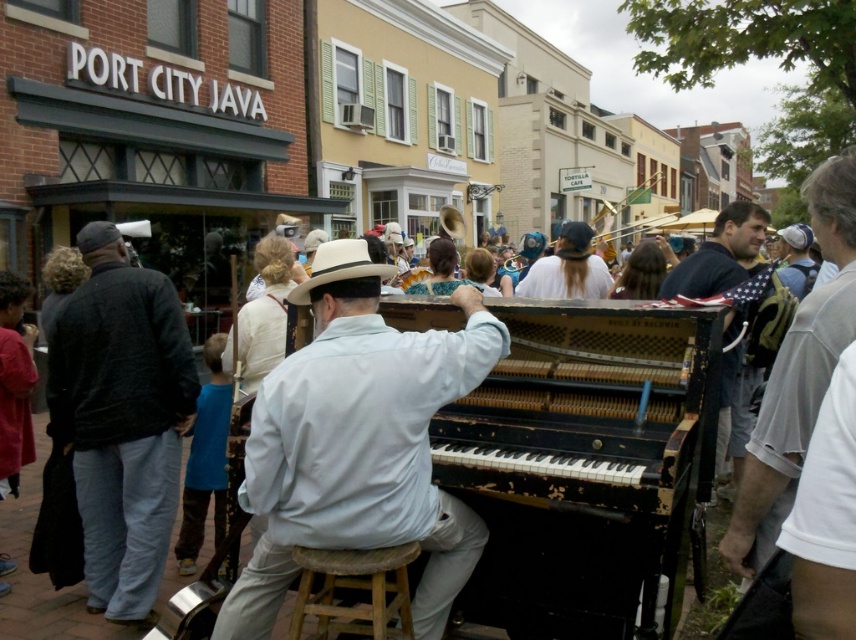
Question: Is dark gray sweater at left positioned at the back of light brown felt cowboy hat at center?

Choices:
 (A) no
 (B) yes

Answer: (B)

Question: Can you confirm if gray cotton shirt at right is bigger than white cotton shirt at center?

Choices:
 (A) no
 (B) yes

Answer: (B)

Question: Considering the real-world distances, which object is closest to the white cotton shirt at center?

Choices:
 (A) wooden stool at center
 (B) gray cotton shirt at right
 (C) black distressed piano at center

Answer: (C)

Question: Which of the following is the closest to the observer?

Choices:
 (A) gray cotton shirt at right
 (B) light blue cotton shirt at center
 (C) wooden stool at center

Answer: (A)

Question: Can you confirm if light blue cotton shirt at center is positioned to the right of wooden stool at center?

Choices:
 (A) yes
 (B) no

Answer: (A)

Question: Which point is closer to the camera taking this photo?

Choices:
 (A) (152, 502)
 (B) (366, 266)

Answer: (B)